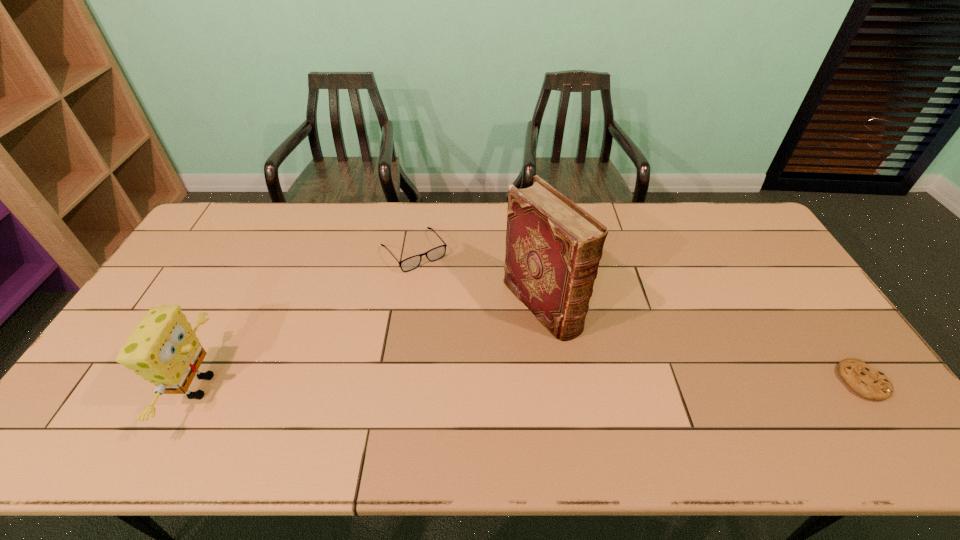
Identify the location of object that is the second closest to the cookie. (411, 263).